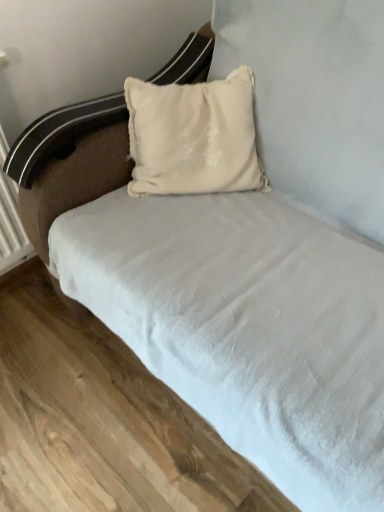
What is the approximate width of beige satin pillow at center?

The width of beige satin pillow at center is 33.42 centimeters.

Measure the distance between point (244, 135) and camera.

Point (244, 135) is 3.82 feet away from camera.

The width and height of the screenshot is (384, 512). What do you see at coordinates (193, 136) in the screenshot? I see `beige satin pillow at center` at bounding box center [193, 136].

Locate an element on the screen. beige satin pillow at center is located at coordinates (193, 136).

Locate an element on the screen. Image resolution: width=384 pixels, height=512 pixels. beige satin pillow at center is located at coordinates (193, 136).